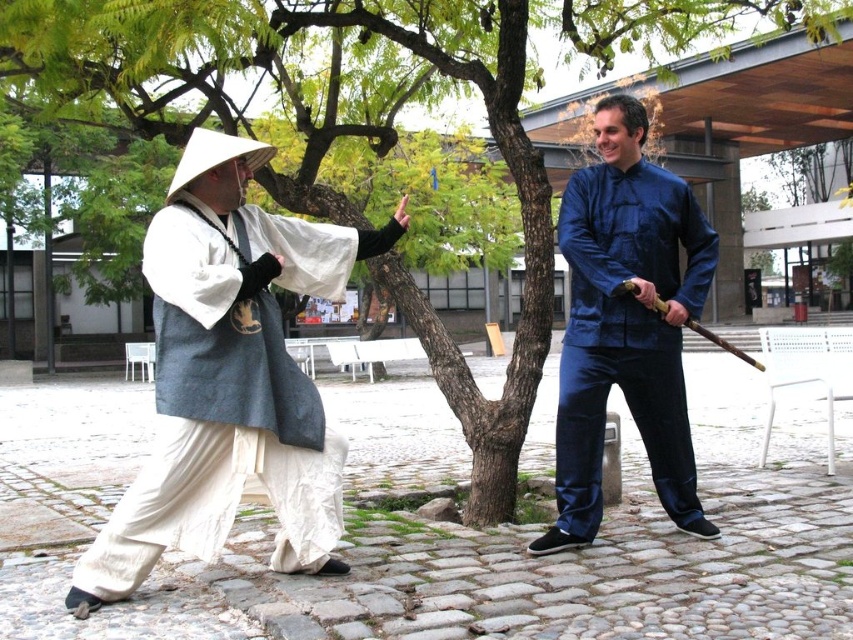
Is point (244, 333) positioned after point (604, 157)?

No, (244, 333) is closer to viewer.

Does white cotton robe at left appear under blue silk shirt at right?

Yes, white cotton robe at left is below blue silk shirt at right.

In order to click on white cotton robe at left in this screenshot , I will do tap(231, 392).

Where is `white cotton robe at left`? The image size is (853, 640). white cotton robe at left is located at coordinates (231, 392).